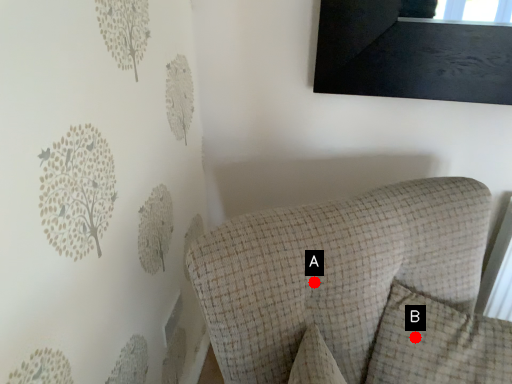
Question: Two points are circled on the image, labeled by A and B beside each circle. Which of the following is the closest to the observer?

Choices:
 (A) A is closer
 (B) B is closer

Answer: (A)